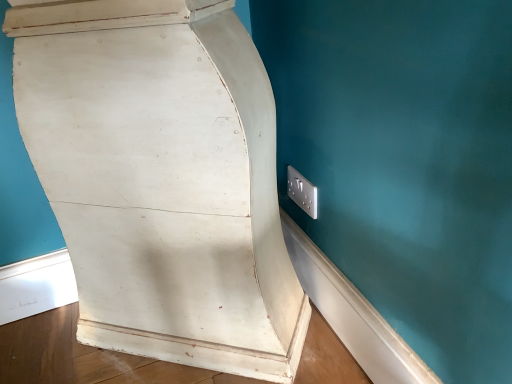
The height and width of the screenshot is (384, 512). What do you see at coordinates (162, 179) in the screenshot? I see `white painted wood cabinet at center` at bounding box center [162, 179].

The width and height of the screenshot is (512, 384). Find the location of `white painted wood cabinet at center`. white painted wood cabinet at center is located at coordinates (162, 179).

Locate an element on the screen. white painted wood cabinet at center is located at coordinates (162, 179).